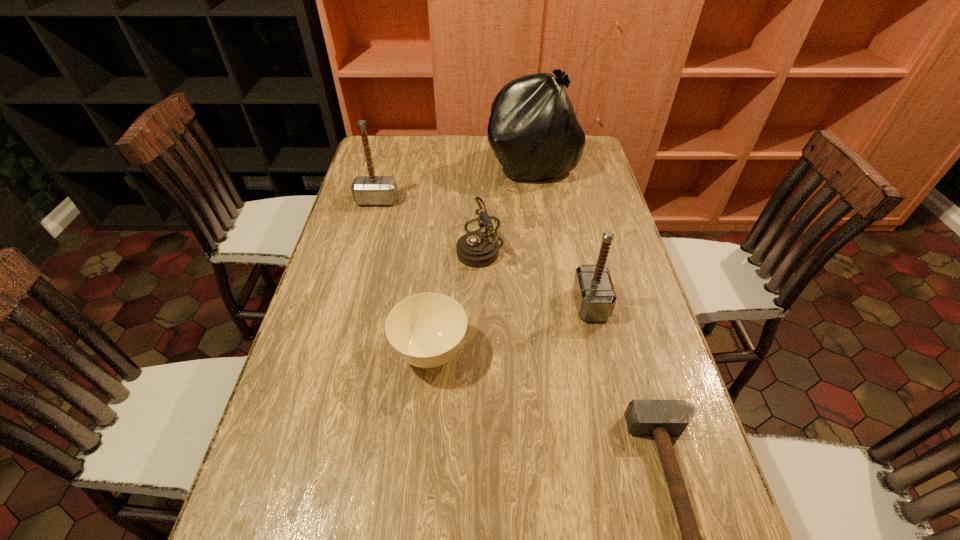
At what (x,y) coordinates should I click in order to perform the action: click on free space at the far left corner of the desktop. Please return your answer as a coordinate pair (x, y). Looking at the image, I should click on (x=387, y=152).

Find the location of a particular element. The width and height of the screenshot is (960, 540). free point between the fourth nearest object and the sugar bowl is located at coordinates (455, 297).

You are a GUI agent. You are given a task and a screenshot of the screen. Output one action in this format:
    pyautogui.click(x=<x>, y=<y>)
    Task: Click on the free space between the second farthest hammer and the fourth nearest object
    The width and height of the screenshot is (960, 540).
    Given the screenshot: What is the action you would take?
    pyautogui.click(x=536, y=273)

The width and height of the screenshot is (960, 540). I want to click on vacant area that lies between the telephone and the sugar bowl, so click(x=455, y=297).

Where is `vacant space in between the leftmost hammer and the telephone`? This screenshot has height=540, width=960. vacant space in between the leftmost hammer and the telephone is located at coordinates (429, 221).

This screenshot has height=540, width=960. Identify the location of free area in between the telephone and the sugar bowl. (455, 297).

Find the location of a particular element. The image size is (960, 540). free space between the second shortest hammer and the tallest object is located at coordinates (562, 234).

I want to click on the second closest object relative to the sugar bowl, so click(x=595, y=297).

Locate which object is the closest to the sugar bowl. Please provide its 2D coordinates. Your answer should be formatted as a tuple, i.e. [(x, y)], where the tuple contains the x and y coordinates of a point satisfying the conditions above.

[(477, 249)]

At what (x,y) coordinates should I click in order to perform the action: click on hammer that stands as the second closest to the third tallest object. Please return your answer as a coordinate pair (x, y). Image resolution: width=960 pixels, height=540 pixels. Looking at the image, I should click on click(x=367, y=190).